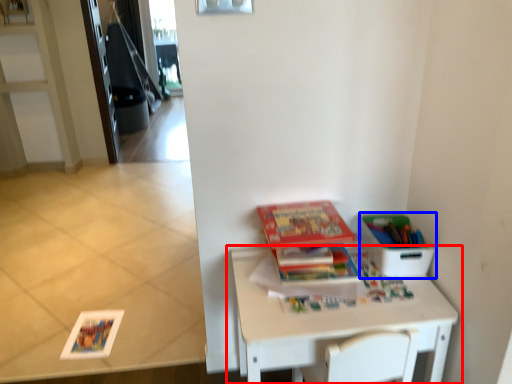
Question: Which of the following is the closest to the observer, table (highlighted by a red box) or cardboard box (highlighted by a blue box)?

Choices:
 (A) table
 (B) cardboard box

Answer: (A)